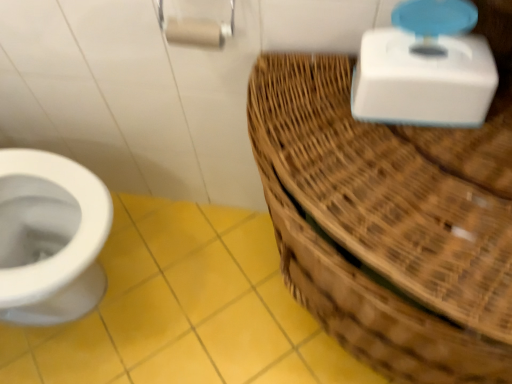
Question: Is yellow matte tile at lower left bigger than white plastic scale at upper right?

Choices:
 (A) no
 (B) yes

Answer: (B)

Question: Considering the relative sizes of yellow matte tile at lower left and white plastic scale at upper right in the image provided, is yellow matte tile at lower left smaller than white plastic scale at upper right?

Choices:
 (A) yes
 (B) no

Answer: (B)

Question: Considering the relative positions of yellow matte tile at lower left and white plastic scale at upper right in the image provided, is yellow matte tile at lower left to the left of white plastic scale at upper right from the viewer's perspective?

Choices:
 (A) no
 (B) yes

Answer: (B)

Question: From a real-world perspective, is yellow matte tile at lower left physically above white plastic scale at upper right?

Choices:
 (A) no
 (B) yes

Answer: (A)

Question: Is yellow matte tile at lower left outside white plastic scale at upper right?

Choices:
 (A) no
 (B) yes

Answer: (B)

Question: From a real-world perspective, is yellow matte tile at lower left beneath white plastic scale at upper right?

Choices:
 (A) yes
 (B) no

Answer: (A)

Question: From a real-world perspective, is woven brown basket at right physically below matte white toilet paper at upper center?

Choices:
 (A) no
 (B) yes

Answer: (B)

Question: Could matte white toilet paper at upper center be considered to be inside woven brown basket at right?

Choices:
 (A) yes
 (B) no

Answer: (B)

Question: From the image's perspective, is woven brown basket at right above matte white toilet paper at upper center?

Choices:
 (A) no
 (B) yes

Answer: (A)

Question: Is woven brown basket at right closer to camera compared to matte white toilet paper at upper center?

Choices:
 (A) no
 (B) yes

Answer: (B)

Question: Considering the relative positions of woven brown basket at right and matte white toilet paper at upper center in the image provided, is woven brown basket at right to the right of matte white toilet paper at upper center from the viewer's perspective?

Choices:
 (A) no
 (B) yes

Answer: (B)

Question: Would you say woven brown basket at right is a long distance from matte white toilet paper at upper center?

Choices:
 (A) no
 (B) yes

Answer: (A)

Question: Is white plastic scale at upper right not close to yellow matte tile at lower left?

Choices:
 (A) no
 (B) yes

Answer: (A)